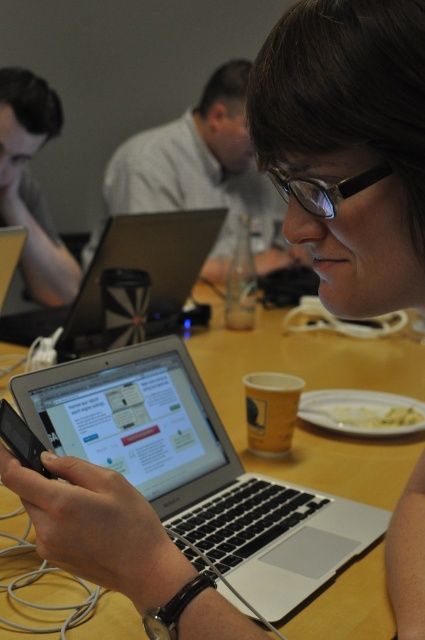
In the scene shown: You are a person sitting at the table and want to grab the transparent plastic glasses at center without moving the matte black laptop at left. Is this possible?

The matte black laptop at left is further to the viewer than transparent plastic glasses at center, so the glasses are behind the laptop. Since the laptop is blocking the direct path, you would need to move the laptop to access the glasses.

You are a person who wants to reach the matte black laptop at left without touching the satin black laptop at center. Is this possible given their positions?

The satin black laptop at center is closer to the viewer than the matte black laptop at left, so you can reach the matte black laptop at left without touching the satin black laptop at center by moving around it.